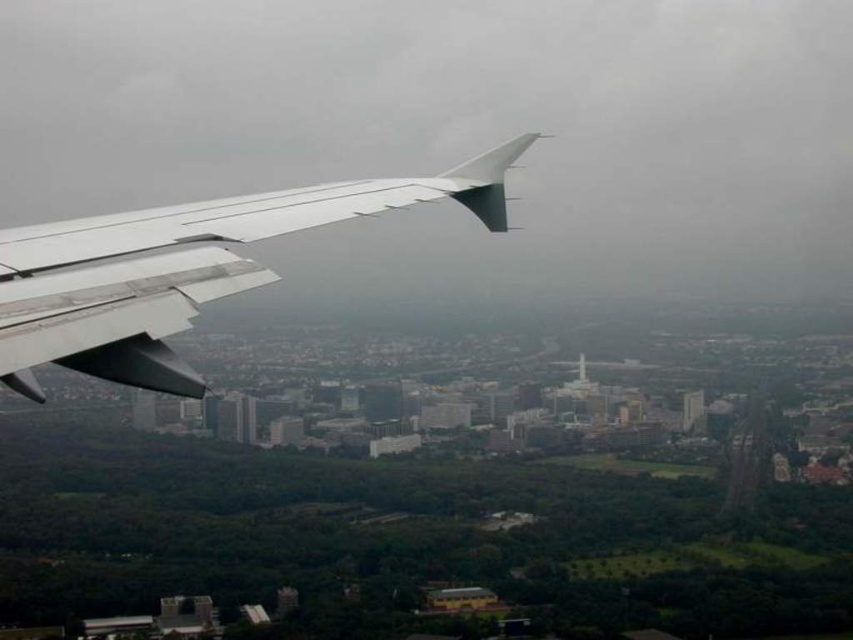
Question: Is white matte wing at left below metallic silver wing at left?

Choices:
 (A) yes
 (B) no

Answer: (B)

Question: Can you confirm if white matte wing at left is positioned to the right of metallic silver wing at left?

Choices:
 (A) yes
 (B) no

Answer: (A)

Question: Among these objects, which one is nearest to the camera?

Choices:
 (A) white matte wing at left
 (B) metallic silver wing at left

Answer: (A)

Question: Does white matte wing at left have a larger size compared to metallic silver wing at left?

Choices:
 (A) no
 (B) yes

Answer: (B)